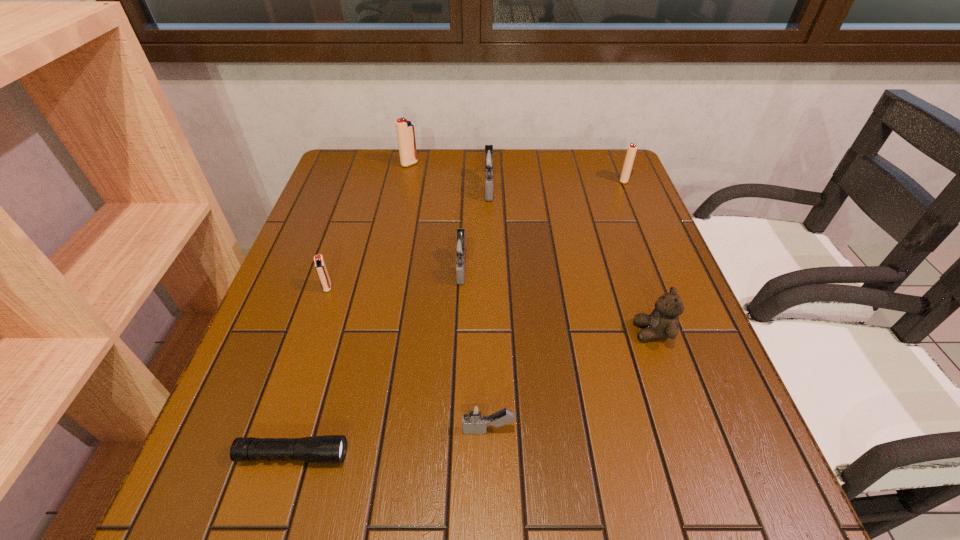
Locate an element on the screen. This screenshot has height=540, width=960. vacant point located between the teddy bear and the biggest gray igniter is located at coordinates (571, 260).

What are the coordinates of `unoccupied area between the farthest igniter and the black flashlight` in the screenshot? It's located at (351, 309).

The width and height of the screenshot is (960, 540). What are the coordinates of `unoccupied area between the biggest red igniter and the smallest red igniter` in the screenshot? It's located at (369, 226).

Image resolution: width=960 pixels, height=540 pixels. Find the location of `free point between the rightmost red igniter and the second farthest gray igniter`. free point between the rightmost red igniter and the second farthest gray igniter is located at coordinates (543, 224).

Identify the location of object that ranks as the third closest to the biggest gray igniter. (631, 151).

I want to click on object that is the second closest one to the nearest gray igniter, so click(663, 322).

Locate an element on the screen. The width and height of the screenshot is (960, 540). the third closest igniter to the smallest gray igniter is located at coordinates (488, 159).

At what (x,y) coordinates should I click in order to perform the action: click on igniter that is the closest to the second farthest red igniter. Please return your answer as a coordinate pair (x, y). The image size is (960, 540). Looking at the image, I should click on (488, 159).

This screenshot has width=960, height=540. Find the location of `red igniter that is the closest to the leftmost red igniter`. red igniter that is the closest to the leftmost red igniter is located at coordinates (405, 131).

Image resolution: width=960 pixels, height=540 pixels. What are the coordinates of `red igniter that can be found as the second closest to the second biggest gray igniter` in the screenshot? It's located at (405, 131).